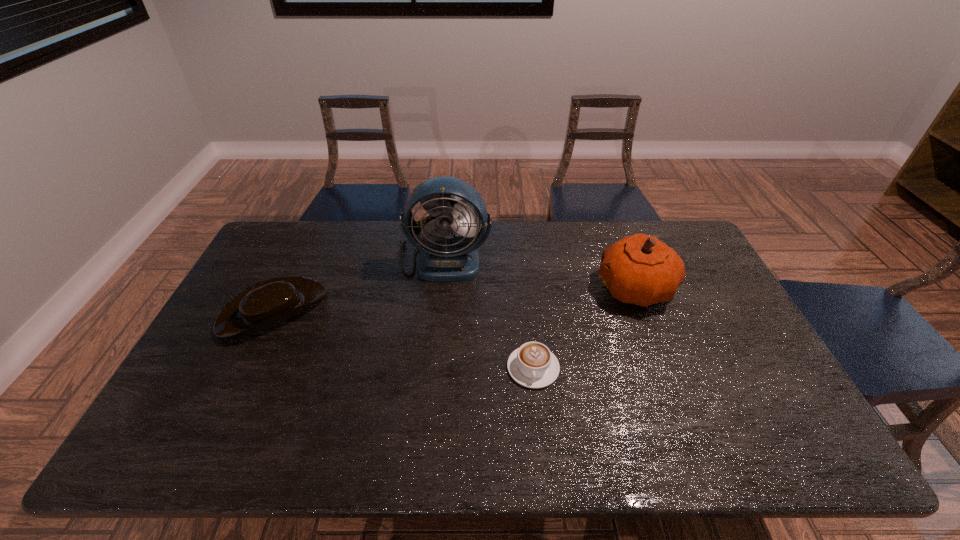
Locate an element on the screen. The height and width of the screenshot is (540, 960). free space at the near edge of the desktop is located at coordinates (239, 437).

This screenshot has width=960, height=540. I want to click on free space at the left edge of the desktop, so click(256, 338).

At what (x,y) coordinates should I click in order to perform the action: click on free space at the right edge of the desktop. Please return your answer as a coordinate pair (x, y). Looking at the image, I should click on (711, 336).

The image size is (960, 540). I want to click on unoccupied position between the third shortest object and the fan, so pos(540,274).

In order to click on free space between the cappuccino and the third shortest object in this screenshot , I will do `click(585, 328)`.

This screenshot has height=540, width=960. In order to click on empty location between the leftmost object and the second object from right to left in this screenshot , I will do `click(403, 339)`.

This screenshot has height=540, width=960. What are the coordinates of `vacant area that lies between the third object from left to right and the third object from right to left` in the screenshot? It's located at (489, 314).

Identify the location of unoccupied area between the tallest object and the third object from left to right. (489, 314).

At what (x,y) coordinates should I click in order to perform the action: click on free space between the rightmost object and the shortest object. Please return your answer as a coordinate pair (x, y). This screenshot has width=960, height=540. Looking at the image, I should click on (585, 328).

Where is `vacant space in between the leftmost object and the rightmost object`? This screenshot has width=960, height=540. vacant space in between the leftmost object and the rightmost object is located at coordinates (454, 299).